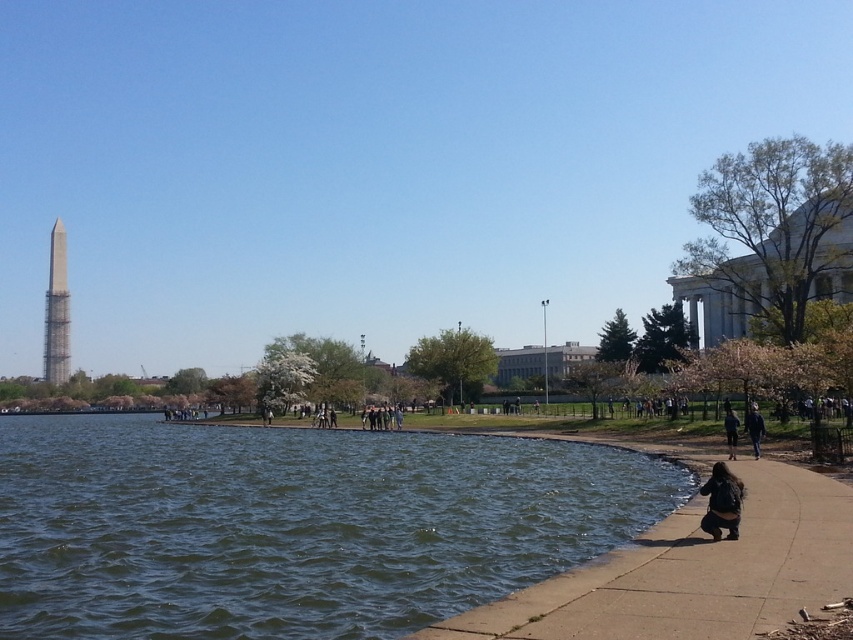
Question: Is silver metallic tower at left further to camera compared to dark brown leather jacket at lower right?

Choices:
 (A) yes
 (B) no

Answer: (A)

Question: Is concrete sidewalk at lower right to the right of dark blue jeans at lower right from the viewer's perspective?

Choices:
 (A) no
 (B) yes

Answer: (A)

Question: Can you confirm if greenish-blue water at lower left is positioned to the left of dark blue jacket at lower right?

Choices:
 (A) yes
 (B) no

Answer: (A)

Question: Estimate the real-world distances between objects in this image. Which object is closer to the dark blue jeans at lower right?

Choices:
 (A) dark blue jacket at lower right
 (B) silver metallic tower at left

Answer: (A)

Question: Which object appears closest to the camera in this image?

Choices:
 (A) silver metallic tower at left
 (B) greenish-blue water at lower left

Answer: (B)

Question: Among these points, which one is farthest from the camera?

Choices:
 (A) (67, 369)
 (B) (0, 625)

Answer: (A)